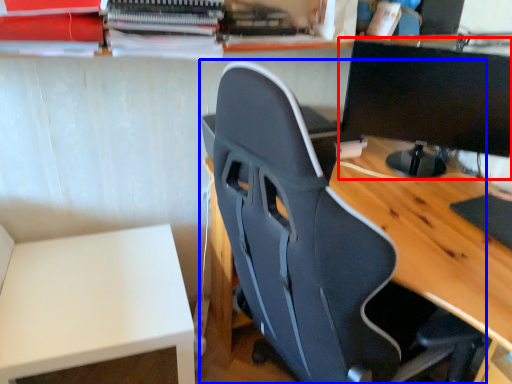
Question: Which of the following is the closest to the observer, computer monitor (highlighted by a red box) or chair (highlighted by a blue box)?

Choices:
 (A) computer monitor
 (B) chair

Answer: (B)